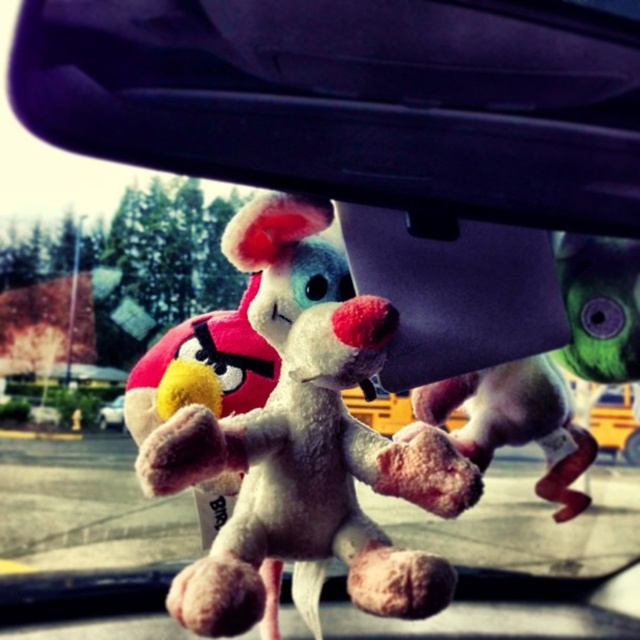
Question: Which object is positioned closest to the fluffy white plush toy at center?

Choices:
 (A) black plastic rearview mirror at upper center
 (B) metallic silver car at lower left
 (C) white plush toy at center

Answer: (C)

Question: Does fluffy white plush toy at center have a larger size compared to white plush toy at center?

Choices:
 (A) yes
 (B) no

Answer: (A)

Question: Estimate the real-world distances between objects in this image. Which object is farther from the white plush toy at center?

Choices:
 (A) metallic silver car at lower left
 (B) fluffy white plush toy at center

Answer: (A)

Question: Considering the relative positions of fluffy white plush toy at center and white plush toy at center in the image provided, where is fluffy white plush toy at center located with respect to white plush toy at center?

Choices:
 (A) left
 (B) right

Answer: (A)

Question: Which of the following is the closest to the observer?

Choices:
 (A) (582, 67)
 (B) (113, 401)
 (C) (291, 289)

Answer: (A)

Question: Does fluffy white plush toy at center have a larger size compared to white plush toy at center?

Choices:
 (A) yes
 (B) no

Answer: (A)